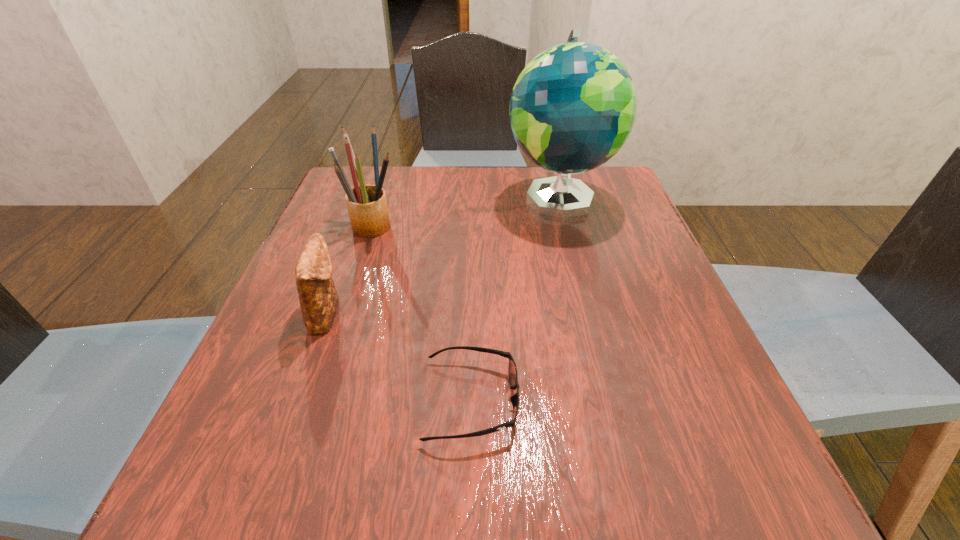
Locate an element on the screen. globe is located at coordinates (572, 108).

Locate an element on the screen. the rightmost object is located at coordinates (572, 108).

Where is `the third shortest object`? the third shortest object is located at coordinates (367, 206).

Locate an element on the screen. clutch bag is located at coordinates (318, 298).

Where is `the third tallest object`? Image resolution: width=960 pixels, height=540 pixels. the third tallest object is located at coordinates (318, 298).

The width and height of the screenshot is (960, 540). In order to click on the third object from left to right in this screenshot , I will do `click(512, 370)`.

Where is `sunglasses`? sunglasses is located at coordinates (512, 370).

Locate an element on the screen. This screenshot has width=960, height=540. blank space located on the front surface of the globe is located at coordinates (581, 284).

Image resolution: width=960 pixels, height=540 pixels. I want to click on vacant space located 0.080m on the front of the pencil box, so click(363, 263).

Locate an element on the screen. free space located 0.380m on the open side of the second nearest object is located at coordinates (548, 313).